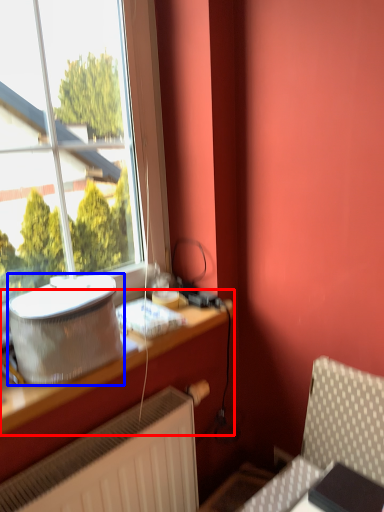
Question: Among these objects, which one is nearest to the camera, table (highlighted by a red box) or appliance (highlighted by a blue box)?

Choices:
 (A) table
 (B) appliance

Answer: (A)